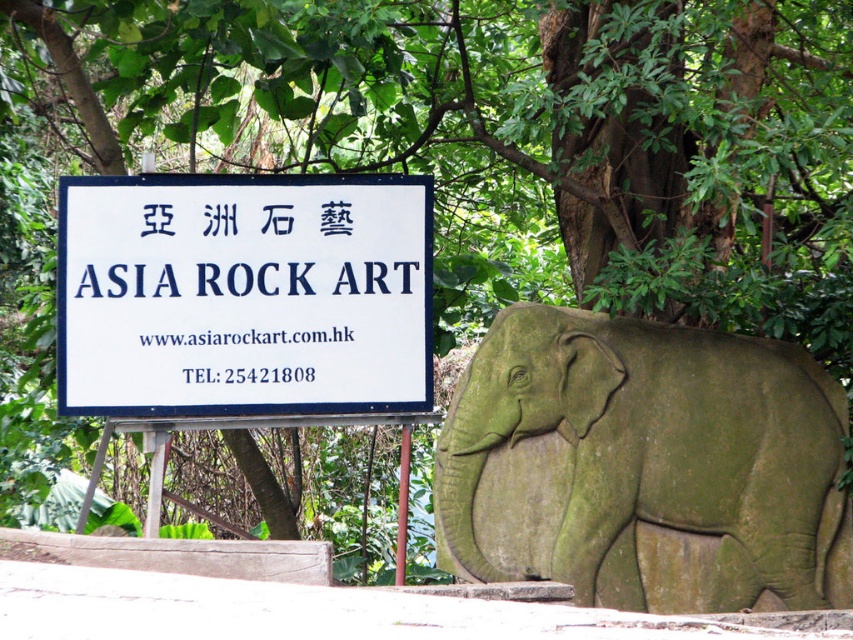
Question: Among these objects, which one is farthest from the camera?

Choices:
 (A) white paper sign at upper center
 (B) green stone elephant at right

Answer: (A)

Question: Is green stone elephant at right behind white paper sign at upper center?

Choices:
 (A) no
 (B) yes

Answer: (A)

Question: Does green stone elephant at right come in front of white paper sign at upper center?

Choices:
 (A) no
 (B) yes

Answer: (B)

Question: Is green stone elephant at right positioned at the back of white paper sign at upper center?

Choices:
 (A) yes
 (B) no

Answer: (B)